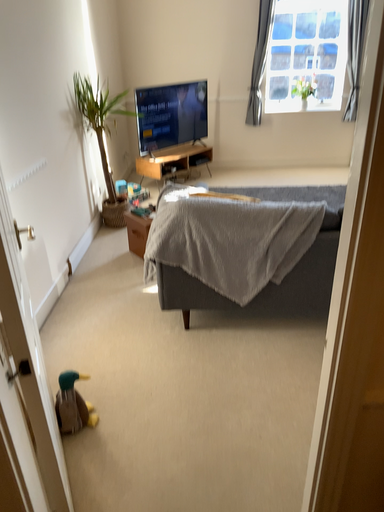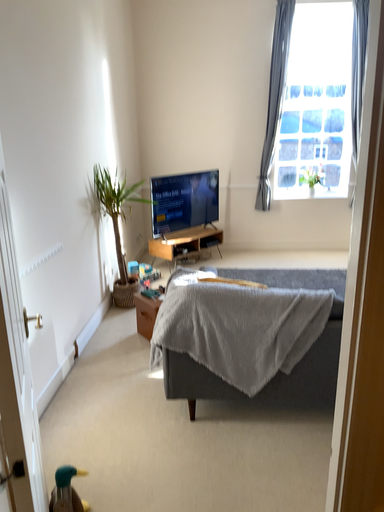
Question: How did the camera likely rotate when shooting the video?

Choices:
 (A) rotated downward
 (B) rotated upward

Answer: (B)